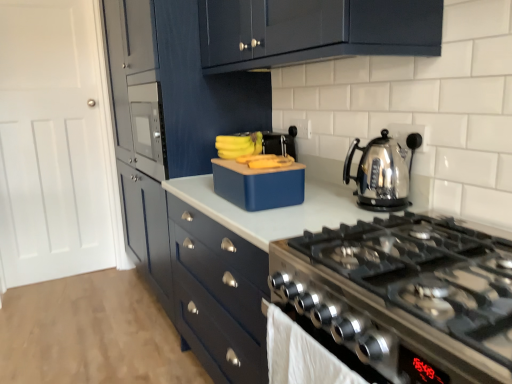
What do you see at coordinates (339, 33) in the screenshot? This screenshot has width=512, height=384. I see `glossy dark blue cabinet at upper center, which appears as the 2th cabinetry when viewed from the back` at bounding box center [339, 33].

What do you see at coordinates (408, 287) in the screenshot?
I see `stainless steel gas stove at lower right` at bounding box center [408, 287].

What is the approximate height of white cotton towel at lower center?

white cotton towel at lower center is 9.72 inches in height.

The height and width of the screenshot is (384, 512). What do you see at coordinates (381, 173) in the screenshot?
I see `stainless steel kettle at right` at bounding box center [381, 173].

Describe the element at coordinates (187, 175) in the screenshot. I see `matte blue cabinets at center, the 2th cabinetry in the front-to-back sequence` at that location.

What do you see at coordinates (259, 185) in the screenshot?
I see `blue matte lunchbox at center` at bounding box center [259, 185].

Identify the location of glossy dark blue cabinet at upper center, which is counted as the first cabinetry, starting from the front. Image resolution: width=512 pixels, height=384 pixels. (339, 33).

From the picture: Is white glossy countertop at center oriented away from light brown wood floor at lower left?

No, white glossy countertop at center is not facing away from light brown wood floor at lower left.

Do you think white glossy countertop at center is within light brown wood floor at lower left, or outside of it?

white glossy countertop at center exists outside the volume of light brown wood floor at lower left.

From a real-world perspective, does white glossy countertop at center stand above light brown wood floor at lower left?

Yes, from a real-world perspective, white glossy countertop at center is above light brown wood floor at lower left.

From the image's perspective, between light brown wood floor at lower left and blue matte lunchbox at center, who is located below?

light brown wood floor at lower left appears lower in the image.

Based on the photo, considering their positions, is light brown wood floor at lower left located in front of or behind blue matte lunchbox at center?

In the image, light brown wood floor at lower left appears behind blue matte lunchbox at center.

From a real-world perspective, between light brown wood floor at lower left and blue matte lunchbox at center, who is vertically lower?

light brown wood floor at lower left, from a real-world perspective.

Considering the relative sizes of stainless steel kettle at right and blue matte lunchbox at center in the image provided, is stainless steel kettle at right bigger than blue matte lunchbox at center?

Incorrect, stainless steel kettle at right is not larger than blue matte lunchbox at center.

Where is `kettle to the right of blue matte lunchbox at center`? The image size is (512, 384). kettle to the right of blue matte lunchbox at center is located at coordinates coord(381,173).

From the image's perspective, is stainless steel kettle at right positioned above or below blue matte lunchbox at center?

stainless steel kettle at right is above blue matte lunchbox at center.

From a real-world perspective, is stainless steel kettle at right located beneath blue matte lunchbox at center?

No.

Between light brown wood floor at lower left and matte blue cabinets at center, which is the first cabinetry in back-to-front order, which one appears on the right side from the viewer's perspective?

matte blue cabinets at center, which is the first cabinetry in back-to-front order, is more to the right.

Is light brown wood floor at lower left facing towards matte blue cabinets at center, the 2th cabinetry in the front-to-back sequence?

No, light brown wood floor at lower left is not oriented towards matte blue cabinets at center, the 2th cabinetry in the front-to-back sequence.

Is light brown wood floor at lower left placed right next to matte blue cabinets at center, the 2th cabinetry in the front-to-back sequence?

light brown wood floor at lower left and matte blue cabinets at center, the 2th cabinetry in the front-to-back sequence, are not in contact.

Consider the image. Is stainless steel gas stove at lower right situated inside glossy dark blue cabinet at upper center, which is counted as the first cabinetry, starting from the front, or outside?

stainless steel gas stove at lower right is spatially situated outside glossy dark blue cabinet at upper center, which is counted as the first cabinetry, starting from the front.

Is stainless steel gas stove at lower right far away from glossy dark blue cabinet at upper center, which appears as the 2th cabinetry when viewed from the back?

That's not correct — stainless steel gas stove at lower right is a little close to glossy dark blue cabinet at upper center, which appears as the 2th cabinetry when viewed from the back.

Which object is further away from the camera taking this photo, stainless steel gas stove at lower right or glossy dark blue cabinet at upper center, which appears as the 2th cabinetry when viewed from the back?

Positioned behind is glossy dark blue cabinet at upper center, which appears as the 2th cabinetry when viewed from the back.

Can you confirm if blue matte lunchbox at center is smaller than white cotton towel at lower center?

No, blue matte lunchbox at center is not smaller than white cotton towel at lower center.

Considering the sizes of blue matte lunchbox at center and white cotton towel at lower center in the image, is blue matte lunchbox at center taller or shorter than white cotton towel at lower center?

In the image, blue matte lunchbox at center appears to be shorter than white cotton towel at lower center.

There is a white cotton towel at lower center. Where is `kitchen appliance above it (from a real-world perspective)`? kitchen appliance above it (from a real-world perspective) is located at coordinates (259, 185).

Are glossy dark blue cabinet at upper center, which appears as the 2th cabinetry when viewed from the back, and light brown wood floor at lower left far apart?

Indeed, glossy dark blue cabinet at upper center, which appears as the 2th cabinetry when viewed from the back, is not near light brown wood floor at lower left.

Between glossy dark blue cabinet at upper center, which is counted as the first cabinetry, starting from the front, and light brown wood floor at lower left, which one has smaller size?

light brown wood floor at lower left.

Considering the relative positions of glossy dark blue cabinet at upper center, which is counted as the first cabinetry, starting from the front, and light brown wood floor at lower left in the image provided, is glossy dark blue cabinet at upper center, which is counted as the first cabinetry, starting from the front, to the left or to the right of light brown wood floor at lower left?

In the image, glossy dark blue cabinet at upper center, which is counted as the first cabinetry, starting from the front, appears on the right side of light brown wood floor at lower left.

I want to click on plain that is under the white glossy countertop at center (from a real-world perspective), so click(91, 333).

Locate an element on the screen. This screenshot has height=384, width=512. kitchen appliance located above the light brown wood floor at lower left (from a real-world perspective) is located at coordinates (259, 185).

When comparing their distances from stainless steel gas stove at lower right, does light brown wood floor at lower left or white cotton towel at lower center seem closer?

Among the two, white cotton towel at lower center is located nearer to stainless steel gas stove at lower right.

Estimate the real-world distances between objects in this image. Which object is closer to stainless steel gas stove at lower right, stainless steel kettle at right or blue matte lunchbox at center?

Among the two, stainless steel kettle at right is located nearer to stainless steel gas stove at lower right.

Considering their positions, is stainless steel gas stove at lower right positioned closer to stainless steel kettle at right than matte blue cabinets at center, which is the first cabinetry in back-to-front order?

stainless steel gas stove at lower right.

When comparing their distances from glossy dark blue cabinet at upper center, which is counted as the first cabinetry, starting from the front, does light brown wood floor at lower left or stainless steel gas stove at lower right seem closer?

stainless steel gas stove at lower right.

Which object lies nearer to the anchor point light brown wood floor at lower left, stainless steel kettle at right or matte blue cabinets at center, the 2th cabinetry in the front-to-back sequence?

matte blue cabinets at center, the 2th cabinetry in the front-to-back sequence, lies closer to light brown wood floor at lower left than the other object.

Looking at the image, which one is located closer to stainless steel gas stove at lower right, white cotton towel at lower center or blue matte lunchbox at center?

Among the two, white cotton towel at lower center is located nearer to stainless steel gas stove at lower right.

Which object lies further to the anchor point stainless steel kettle at right, white glossy countertop at center or blue matte lunchbox at center?

blue matte lunchbox at center is positioned further to the anchor stainless steel kettle at right.

Looking at the image, which one is located further to stainless steel gas stove at lower right, matte blue cabinets at center, which is the first cabinetry in back-to-front order, or light brown wood floor at lower left?

light brown wood floor at lower left is positioned further to the anchor stainless steel gas stove at lower right.

This screenshot has height=384, width=512. In order to click on countertop between light brown wood floor at lower left and white cotton towel at lower center in this screenshot , I will do `click(269, 210)`.

At what (x,y) coordinates should I click in order to perform the action: click on kettle between glossy dark blue cabinet at upper center, which is counted as the first cabinetry, starting from the front, and white cotton towel at lower center, in the vertical direction. Please return your answer as a coordinate pair (x, y). Image resolution: width=512 pixels, height=384 pixels. Looking at the image, I should click on [x=381, y=173].

I want to click on kitchen appliance located between matte blue cabinets at center, the 2th cabinetry in the front-to-back sequence, and stainless steel kettle at right in the left-right direction, so click(x=259, y=185).

I want to click on countertop between light brown wood floor at lower left and stainless steel gas stove at lower right, so click(x=269, y=210).